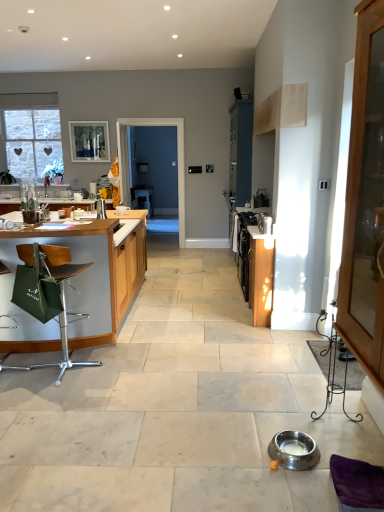
Question: Considering the relative sizes of matte glass window screen at upper left and green leather chair at left in the image provided, is matte glass window screen at upper left wider than green leather chair at left?

Choices:
 (A) yes
 (B) no

Answer: (B)

Question: Is matte glass window screen at upper left touching green leather chair at left?

Choices:
 (A) no
 (B) yes

Answer: (A)

Question: From the image's perspective, is matte glass window screen at upper left located above green leather chair at left?

Choices:
 (A) yes
 (B) no

Answer: (A)

Question: Does matte glass window screen at upper left have a smaller size compared to green leather chair at left?

Choices:
 (A) no
 (B) yes

Answer: (B)

Question: Is matte glass window screen at upper left further to the viewer compared to green leather chair at left?

Choices:
 (A) yes
 (B) no

Answer: (A)

Question: Can you confirm if matte glass window screen at upper left is shorter than green leather chair at left?

Choices:
 (A) no
 (B) yes

Answer: (B)

Question: Is satin silver kettle at center-right, marked as the second appliance in a bottom-to-top arrangement, shorter than purple fabric swivel chair at lower right?

Choices:
 (A) no
 (B) yes

Answer: (A)

Question: Is the position of satin silver kettle at center-right, marked as the second appliance in a front-to-back arrangement, less distant than that of purple fabric swivel chair at lower right?

Choices:
 (A) no
 (B) yes

Answer: (A)

Question: Does satin silver kettle at center-right, marked as the second appliance in a bottom-to-top arrangement, have a lesser width compared to purple fabric swivel chair at lower right?

Choices:
 (A) yes
 (B) no

Answer: (A)

Question: Considering the relative sizes of satin silver kettle at center-right, marked as the second appliance in a bottom-to-top arrangement, and purple fabric swivel chair at lower right in the image provided, is satin silver kettle at center-right, marked as the second appliance in a bottom-to-top arrangement, smaller than purple fabric swivel chair at lower right?

Choices:
 (A) no
 (B) yes

Answer: (B)

Question: Does satin silver kettle at center-right, marked as the second appliance in a front-to-back arrangement, turn towards purple fabric swivel chair at lower right?

Choices:
 (A) no
 (B) yes

Answer: (A)

Question: Can you confirm if satin silver kettle at center-right, marked as the second appliance in a bottom-to-top arrangement, is positioned to the right of purple fabric swivel chair at lower right?

Choices:
 (A) yes
 (B) no

Answer: (B)

Question: Can you confirm if green fabric table at left is wider than transparent glass screen door at center?

Choices:
 (A) yes
 (B) no

Answer: (A)